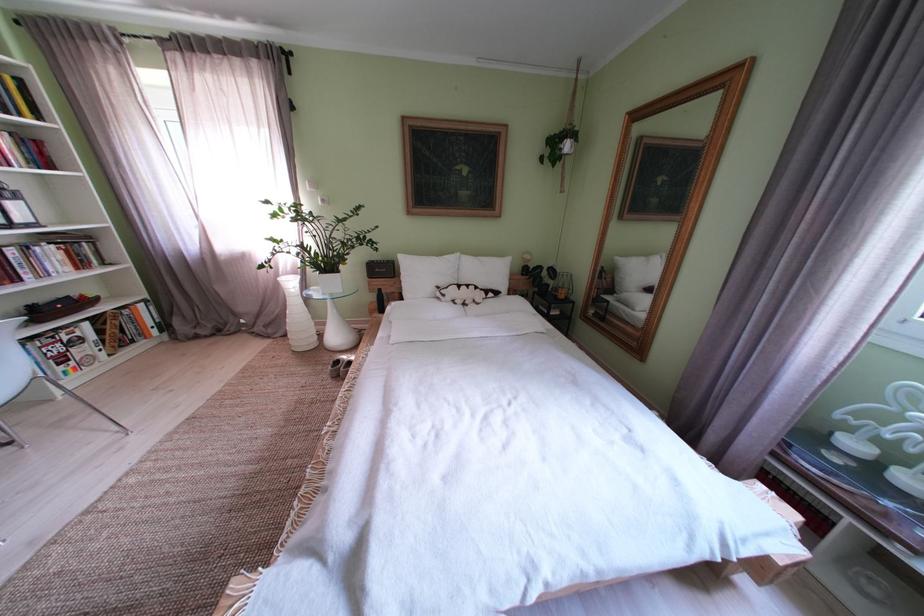
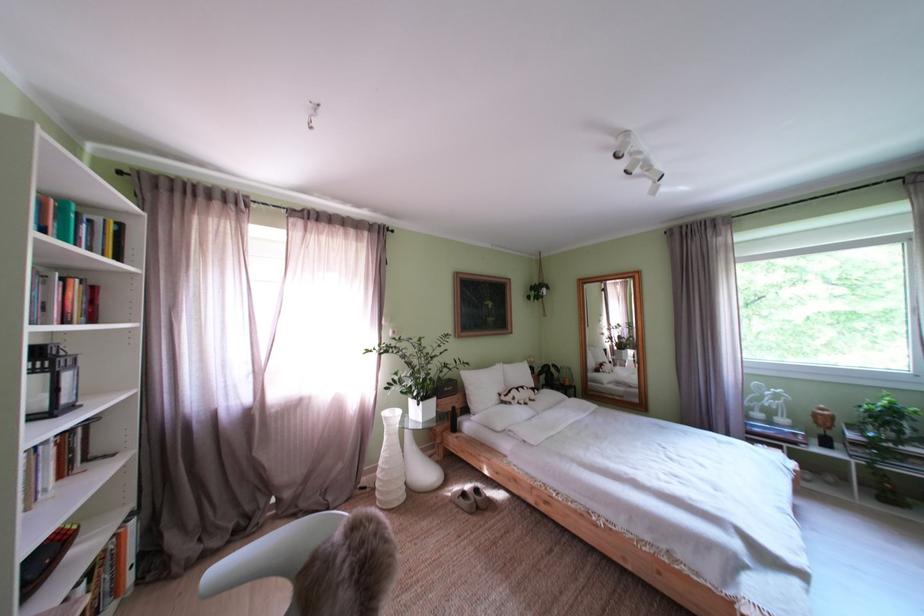
Where in the second image is the point corresponding to point 489,306 from the first image?

(543, 403)